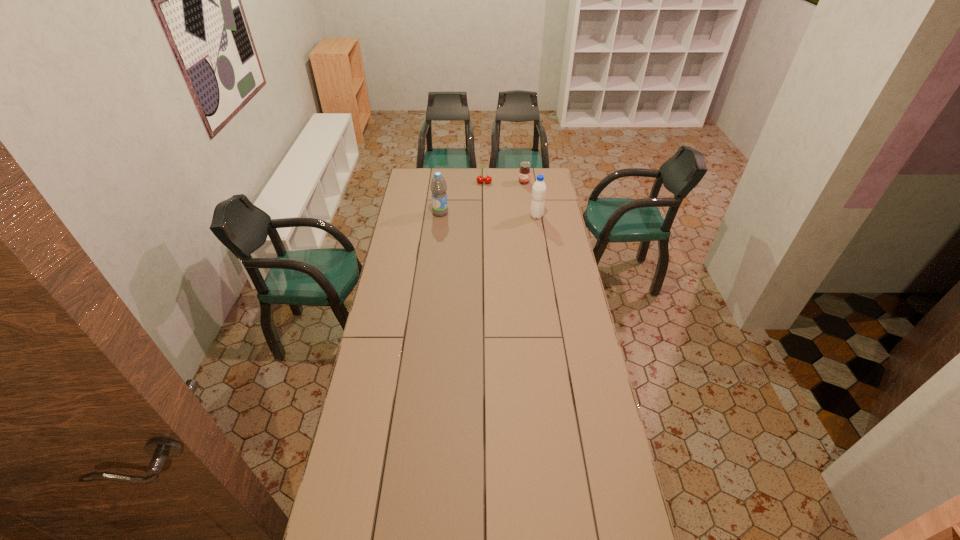
Find the location of a particular element. free location located 0.270m on the label side of the jam is located at coordinates (504, 207).

Where is `vacant space located on the label side of the jam`? The height and width of the screenshot is (540, 960). vacant space located on the label side of the jam is located at coordinates (506, 205).

At what (x,y) coordinates should I click in order to perform the action: click on cherry situated at the far edge. Please return your answer as a coordinate pair (x, y). This screenshot has width=960, height=540. Looking at the image, I should click on (480, 179).

At what (x,y) coordinates should I click in order to perform the action: click on jam positioned at the far edge. Please return your answer as a coordinate pair (x, y). Looking at the image, I should click on (524, 173).

Identify the location of water bottle located at the right edge. The height and width of the screenshot is (540, 960). (539, 188).

I want to click on jam present at the right edge, so click(524, 173).

Locate an element on the screen. Image resolution: width=960 pixels, height=540 pixels. object that is positioned at the far right corner is located at coordinates (524, 173).

You are a GUI agent. You are given a task and a screenshot of the screen. Output one action in this format:
    pyautogui.click(x=<x>, y=<y>)
    Task: Click on the free space at the far edge of the desktop
    
    Given the screenshot: What is the action you would take?
    pyautogui.click(x=509, y=178)

Where is `vacant space at the near edge`? The height and width of the screenshot is (540, 960). vacant space at the near edge is located at coordinates (481, 534).

Where is `free space at the left edge`? Image resolution: width=960 pixels, height=540 pixels. free space at the left edge is located at coordinates (360, 407).